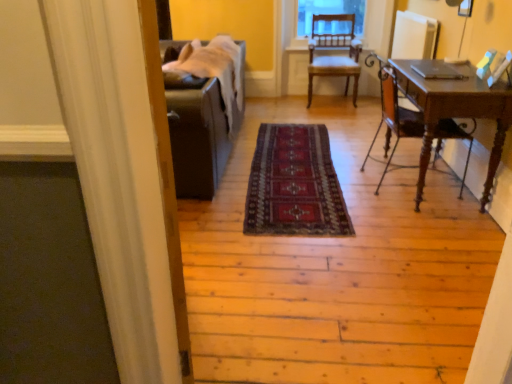
What do you see at coordinates (394, 118) in the screenshot? I see `mahogany wood desk at right, which is the 2th chair in top-to-bottom order` at bounding box center [394, 118].

Find the location of `dark red woven rug at center`. dark red woven rug at center is located at coordinates (294, 184).

Describe the element at coordinates (294, 184) in the screenshot. The width and height of the screenshot is (512, 384). I see `dark red woven rug at center` at that location.

In order to click on mahogany wood desk at right, the 1th chair when ordered from bottom to top in this screenshot , I will do `click(394, 118)`.

Is dark red woven rug at center looking in the opposite direction of wooden chair at center, which appears as the 2th chair when ordered from the bottom?

That's not correct — dark red woven rug at center is not looking away from wooden chair at center, which appears as the 2th chair when ordered from the bottom.

Considering the sizes of dark red woven rug at center and wooden chair at center, which appears as the 2th chair when ordered from the bottom, in the image, is dark red woven rug at center wider or thinner than wooden chair at center, which appears as the 2th chair when ordered from the bottom,?

dark red woven rug at center is wider than wooden chair at center, which appears as the 2th chair when ordered from the bottom.

Considering the positions of objects dark red woven rug at center and wooden chair at center, which is the 2th chair in front-to-back order, in the image provided, who is behind, dark red woven rug at center or wooden chair at center, which is the 2th chair in front-to-back order,?

wooden chair at center, which is the 2th chair in front-to-back order, is behind.

Between dark red woven rug at center and wooden chair at center, which appears as the 2th chair when ordered from the bottom, which one has larger size?

wooden chair at center, which appears as the 2th chair when ordered from the bottom.

Does mahogany wood desk at right, the 1th chair when ordered from bottom to top, turn towards wooden chair at center, arranged as the first chair when viewed from the back?

No, mahogany wood desk at right, the 1th chair when ordered from bottom to top, is not aimed at wooden chair at center, arranged as the first chair when viewed from the back.

Is mahogany wood desk at right, the 1th chair when ordered from bottom to top, taller than wooden chair at center, which appears as the 2th chair when ordered from the bottom?

No, mahogany wood desk at right, the 1th chair when ordered from bottom to top, is not taller than wooden chair at center, which appears as the 2th chair when ordered from the bottom.

Would you say mahogany wood desk at right, which is the 2th chair in top-to-bottom order, is inside or outside wooden chair at center, which is the 2th chair in front-to-back order?

mahogany wood desk at right, which is the 2th chair in top-to-bottom order, is outside wooden chair at center, which is the 2th chair in front-to-back order.

Is wooden chair at center, which is the 2th chair in front-to-back order, positioned with its back to dark red woven rug at center?

No, wooden chair at center, which is the 2th chair in front-to-back order,'s orientation is not away from dark red woven rug at center.

The height and width of the screenshot is (384, 512). In the image, there is a wooden chair at center, arranged as the first chair when viewed from the back. In order to click on mat below it (from a real-world perspective) in this screenshot , I will do `click(294, 184)`.

Choose the correct answer: Is wooden chair at center, which appears as the 2th chair when ordered from the bottom, inside dark red woven rug at center or outside it?

The correct answer is: outside.

Considering the sizes of objects wooden chair at center, which is the 2th chair in front-to-back order, and dark red woven rug at center in the image provided, who is thinner, wooden chair at center, which is the 2th chair in front-to-back order, or dark red woven rug at center?

With smaller width is wooden chair at center, which is the 2th chair in front-to-back order.

Considering the points (366, 158) and (298, 187), which point is in front, point (366, 158) or point (298, 187)?

The point (298, 187) is more forward.

Who is bigger, mahogany wood desk at right, the first chair positioned from the front, or dark red woven rug at center?

Bigger between the two is mahogany wood desk at right, the first chair positioned from the front.

Looking at this image, from the image's perspective, between mahogany wood desk at right, acting as the second chair starting from the back, and dark red woven rug at center, who is located below?

dark red woven rug at center appears lower in the image.

From their relative heights in the image, would you say wooden chair at center, placed as the 1th chair when sorted from top to bottom, is taller or shorter than mahogany wood desk at right, which is the 2th chair in top-to-bottom order?

Clearly, wooden chair at center, placed as the 1th chair when sorted from top to bottom, is taller compared to mahogany wood desk at right, which is the 2th chair in top-to-bottom order.

Can you confirm if wooden chair at center, which is the 2th chair in front-to-back order, is bigger than mahogany wood desk at right, the first chair positioned from the front?

Yes.

From the picture: From a real-world perspective, is wooden chair at center, which is the 2th chair in front-to-back order, over mahogany wood desk at right, the first chair positioned from the front?

Yes, from a real-world perspective, wooden chair at center, which is the 2th chair in front-to-back order, is over mahogany wood desk at right, the first chair positioned from the front

How far apart are wooden chair at center, which appears as the 2th chair when ordered from the bottom, and mahogany wood desk at right, which is the 2th chair in top-to-bottom order?

wooden chair at center, which appears as the 2th chair when ordered from the bottom, and mahogany wood desk at right, which is the 2th chair in top-to-bottom order, are 1.89 meters apart from each other.

Is dark red woven rug at center situated inside mahogany wood desk at right, the 1th chair when ordered from bottom to top, or outside?

dark red woven rug at center exists outside the volume of mahogany wood desk at right, the 1th chair when ordered from bottom to top.

What's the angular difference between dark red woven rug at center and mahogany wood desk at right, which is the 2th chair in top-to-bottom order,'s facing directions?

91.4 degrees.

Which of these two, dark red woven rug at center or mahogany wood desk at right, acting as the second chair starting from the back, is bigger?

mahogany wood desk at right, acting as the second chair starting from the back.

Does dark red woven rug at center appear on the left side of mahogany wood desk at right, acting as the second chair starting from the back?

Indeed, dark red woven rug at center is positioned on the left side of mahogany wood desk at right, acting as the second chair starting from the back.

Where is `the 2nd chair behind when counting from the dark red woven rug at center`? Image resolution: width=512 pixels, height=384 pixels. the 2nd chair behind when counting from the dark red woven rug at center is located at coordinates (334, 47).

In the image, there is a mahogany wood desk at right, the first chair positioned from the front. Where is `chair above it (from the image's perspective)`? chair above it (from the image's perspective) is located at coordinates (334, 47).

Which object lies further to the anchor point dark red woven rug at center, mahogany wood desk at right, the 1th chair when ordered from bottom to top, or wooden chair at center, arranged as the first chair when viewed from the back?

Among the two, wooden chair at center, arranged as the first chair when viewed from the back, is located further to dark red woven rug at center.

Which object lies further to the anchor point wooden chair at center, placed as the 1th chair when sorted from top to bottom, dark red woven rug at center or mahogany wood desk at right, which is the 2th chair in top-to-bottom order?

mahogany wood desk at right, which is the 2th chair in top-to-bottom order.

Considering their positions, is dark red woven rug at center positioned further to mahogany wood desk at right, the 1th chair when ordered from bottom to top, than wooden chair at center, which is the 2th chair in front-to-back order?

wooden chair at center, which is the 2th chair in front-to-back order, is positioned further to the anchor mahogany wood desk at right, the 1th chair when ordered from bottom to top.

Which object lies further to the anchor point dark red woven rug at center, wooden chair at center, placed as the 1th chair when sorted from top to bottom, or mahogany wood desk at right, the first chair positioned from the front?

The object further to dark red woven rug at center is wooden chair at center, placed as the 1th chair when sorted from top to bottom.

Considering their positions, is wooden chair at center, arranged as the first chair when viewed from the back, positioned closer to mahogany wood desk at right, the 1th chair when ordered from bottom to top, than dark red woven rug at center?

Among the two, dark red woven rug at center is located nearer to mahogany wood desk at right, the 1th chair when ordered from bottom to top.

Looking at the image, which one is located closer to wooden chair at center, which is the 2th chair in front-to-back order, mahogany wood desk at right, acting as the second chair starting from the back, or dark red woven rug at center?

dark red woven rug at center is positioned closer to the anchor wooden chair at center, which is the 2th chair in front-to-back order.

Identify the location of chair between dark red woven rug at center and wooden chair at center, which appears as the 2th chair when ordered from the bottom, along the z-axis. (394, 118).